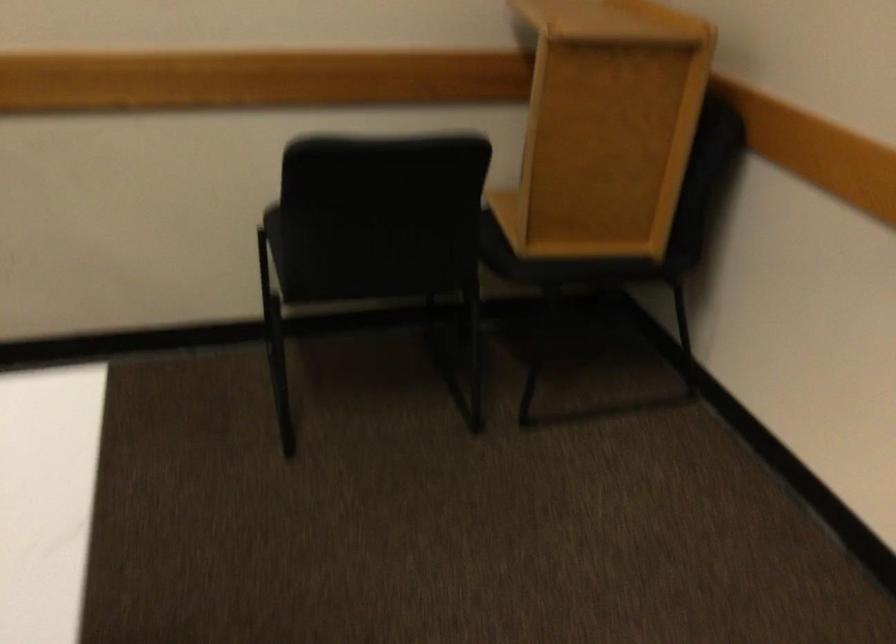
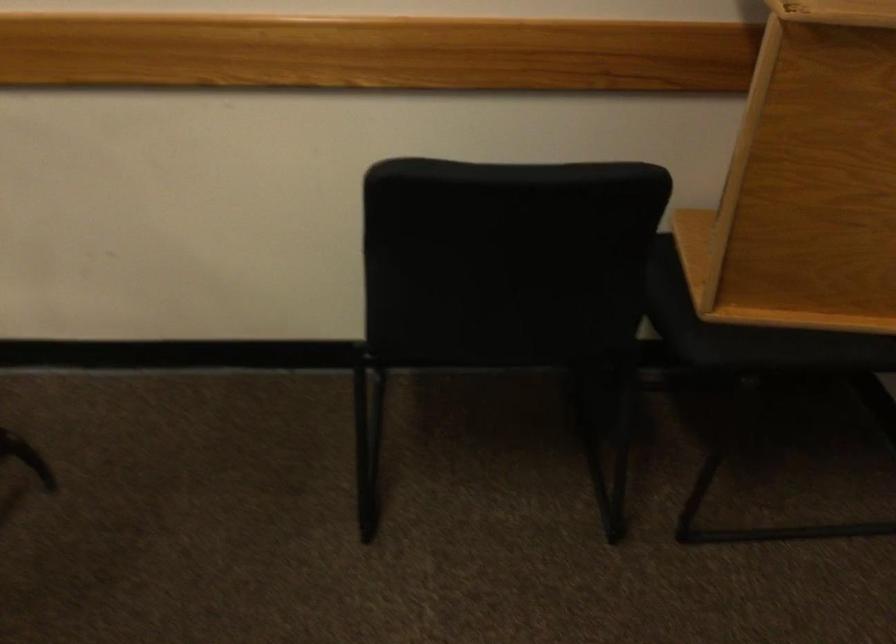
Question: The camera is either moving clockwise (left) or counter-clockwise (right) around the object. The first image is from the beginning of the video and the second image is from the end. Is the camera moving left or right when shooting the video?

Choices:
 (A) Left
 (B) Right

Answer: (B)